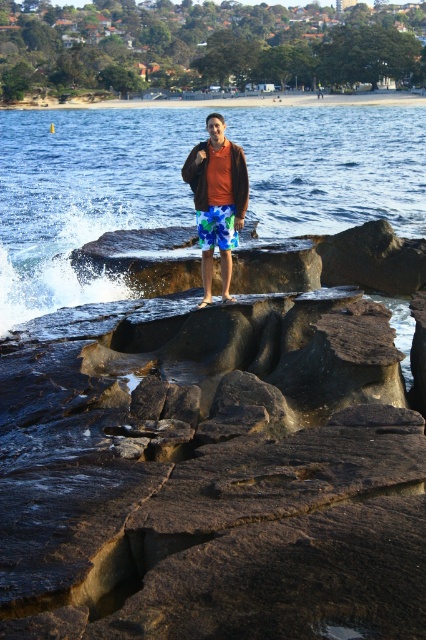
Does matte brown jacket at center have a smaller size compared to blue printed fabric shorts at center?

No, matte brown jacket at center is not smaller than blue printed fabric shorts at center.

Which is in front, point (187, 168) or point (210, 248)?

Point (187, 168)

Identify the location of matte brown jacket at center. pyautogui.click(x=216, y=198).

Does brown rock at center appear on the left side of clear blue water at center?

In fact, brown rock at center is to the right of clear blue water at center.

Is point (256, 353) closer to viewer compared to point (94, 164)?

Yes, point (256, 353) is closer to viewer.

Who is more distant from viewer, (247,609) or (170,150)?

The point (170,150) is more distant.

Where is `brown rock at center`? brown rock at center is located at coordinates pyautogui.click(x=210, y=472).

Does brown rock at center have a lesser height compared to matte brown jacket at center?

No, brown rock at center is not shorter than matte brown jacket at center.

Is point (268, 307) farther from camera compared to point (236, 163)?

Yes.

Which is in front, point (337, 429) or point (203, 211)?

Point (337, 429) is in front.

Locate an element on the screen. brown rock at center is located at coordinates point(210,472).